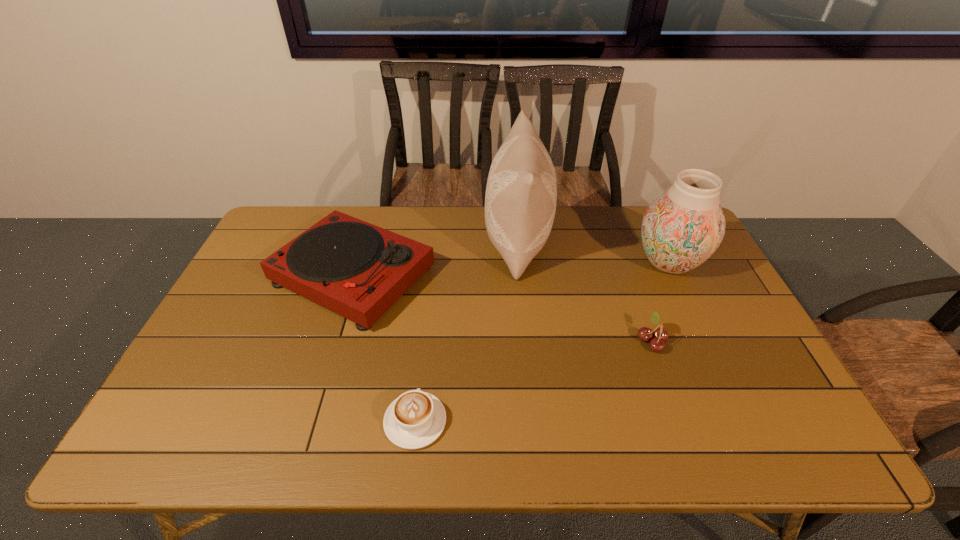
Find the location of a particular element. The height and width of the screenshot is (540, 960). vacant space positioned on the back of the vase is located at coordinates (652, 228).

Find the location of a particular element. free space located on the front of the record player is located at coordinates (317, 392).

In order to click on vacant point located on the leaves of the fourth tallest object in this screenshot , I will do `click(554, 341)`.

Identify the location of vacant region located on the leaves of the fourth tallest object. tap(618, 341).

You are a GUI agent. You are given a task and a screenshot of the screen. Output one action in this format:
    pyautogui.click(x=<x>, y=<y>)
    Task: Click on the free spot located 0.100m on the leaves of the fourth tallest object
    The image size is (960, 540).
    Given the screenshot: What is the action you would take?
    pyautogui.click(x=599, y=341)

Locate an element on the screen. vacant space located with the handle on the right side of the shortest object is located at coordinates (429, 303).

Find the location of `vacant space located with the handle on the right side of the shortest object`. vacant space located with the handle on the right side of the shortest object is located at coordinates (430, 291).

Where is `vacant area located with the handle on the right side of the shortest object`? The width and height of the screenshot is (960, 540). vacant area located with the handle on the right side of the shortest object is located at coordinates (431, 286).

This screenshot has height=540, width=960. I want to click on cushion located in the far edge section of the desktop, so (521, 194).

Where is `vase at the far edge`? vase at the far edge is located at coordinates click(x=683, y=227).